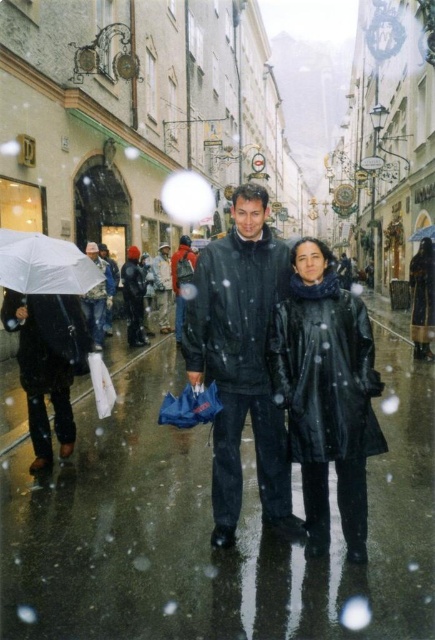
Question: Considering the relative positions of camouflage jacket at left and dark matte jacket at center in the image provided, where is camouflage jacket at left located with respect to dark matte jacket at center?

Choices:
 (A) left
 (B) right

Answer: (A)

Question: Can you confirm if black leather coat at center is positioned to the right of matte black coat at center?

Choices:
 (A) yes
 (B) no

Answer: (B)

Question: Is camouflage jacket at left wider than dark matte jacket at center?

Choices:
 (A) no
 (B) yes

Answer: (B)

Question: Which point is closer to the camera?

Choices:
 (A) (87, 314)
 (B) (415, 269)
 (C) (74, 252)

Answer: (C)

Question: Among these objects, which one is farthest from the camera?

Choices:
 (A) matte black coat at center
 (B) black leather coat at center
 (C) white matte umbrella at left
 (D) camouflage jacket at left

Answer: (A)

Question: Which is nearer to the glossy asphalt pavement at center?

Choices:
 (A) camouflage jacket at left
 (B) white matte umbrella at left
 (C) matte black jacket at center

Answer: (C)